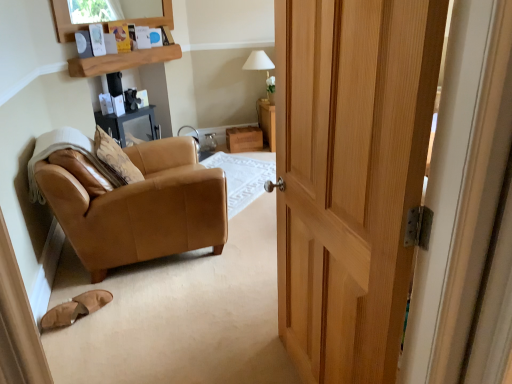
Question: From a real-world perspective, relative to wooden shelf at upper center, is wooden drawer at center vertically above or below?

Choices:
 (A) above
 (B) below

Answer: (B)

Question: Considering the positions of wooden drawer at center and wooden shelf at upper center in the image, is wooden drawer at center taller or shorter than wooden shelf at upper center?

Choices:
 (A) tall
 (B) short

Answer: (A)

Question: Considering the real-world distances, which object is closest to the tan suede slippers at lower left?

Choices:
 (A) white fabric lampshade at upper center
 (B) tan leather chair at left
 (C) wooden shelf at upper center
 (D) wooden drawer at center

Answer: (B)

Question: Which object is positioned farthest from the white fabric lampshade at upper center?

Choices:
 (A) wooden shelf at upper center
 (B) tan suede slippers at lower left
 (C) tan leather chair at left
 (D) wooden drawer at center

Answer: (B)